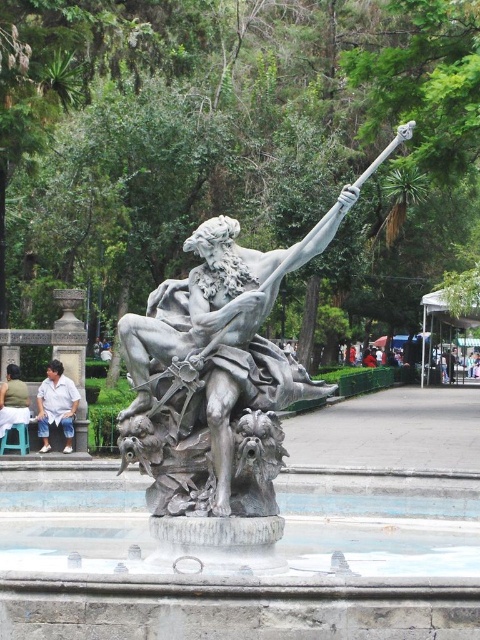
In the scene shown: Can you confirm if bronze statue at center is positioned to the right of light brown fabric shirt at center?

Indeed, bronze statue at center is positioned on the right side of light brown fabric shirt at center.

You are a GUI agent. You are given a task and a screenshot of the screen. Output one action in this format:
    pyautogui.click(x=<x>, y=<y>)
    Task: Click on the bronze statue at center
    
    Given the screenshot: What is the action you would take?
    pyautogui.click(x=210, y=384)

The image size is (480, 640). What are the coordinates of `bronze statue at center` in the screenshot? It's located at point(210,384).

Consider the image. Does light blue jeans at lower left have a lesser width compared to light brown fabric shirt at center?

Correct, light blue jeans at lower left's width is less than light brown fabric shirt at center's.

Between light blue jeans at lower left and light brown fabric shirt at center, which one has less height?

light blue jeans at lower left is shorter.

This screenshot has height=640, width=480. Find the location of `light blue jeans at lower left`. light blue jeans at lower left is located at coordinates (57, 404).

Can you confirm if bronze statue at center is bigger than light blue jeans at lower left?

Correct, bronze statue at center is larger in size than light blue jeans at lower left.

Is bronze statue at center positioned at the back of light blue jeans at lower left?

No.

Does point (213, 352) come in front of point (38, 433)?

Yes, it is.

Locate an element on the screen. This screenshot has height=640, width=480. bronze statue at center is located at coordinates (210, 384).